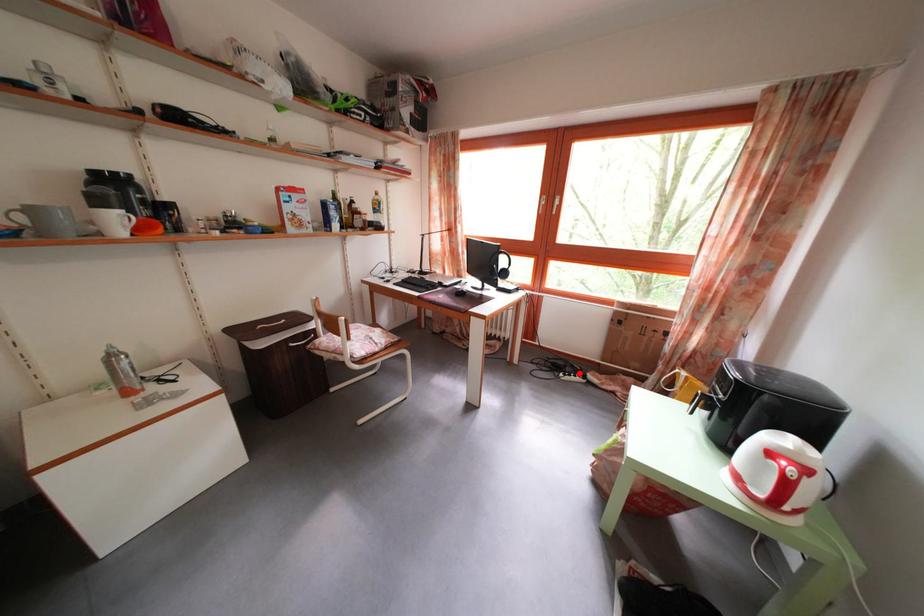
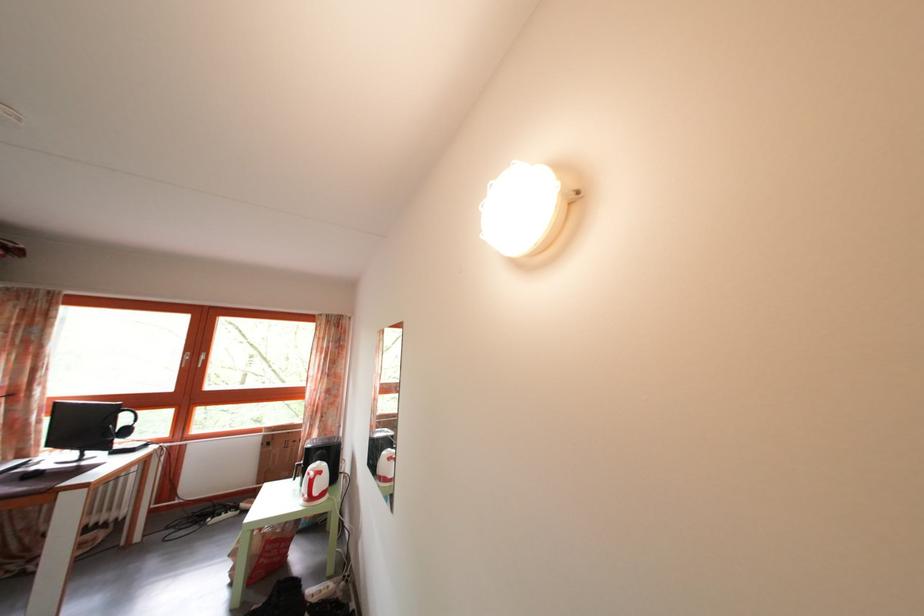
Question: I am providing you with two images of the same scene from different viewpoints. Image1 has a red point marked. In image2, the corresponding 3D location appears at what relative position? Reply with the corresponding letter.

Choices:
 (A) Closer
 (B) Farther

Answer: (B)